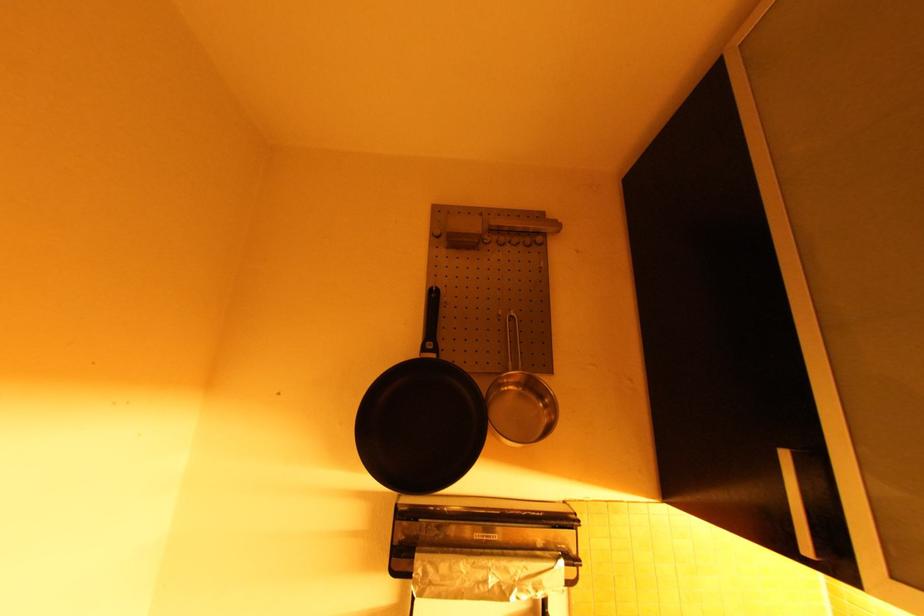
This screenshot has height=616, width=924. Describe the element at coordinates (513, 342) in the screenshot. I see `a metal ladle handle` at that location.